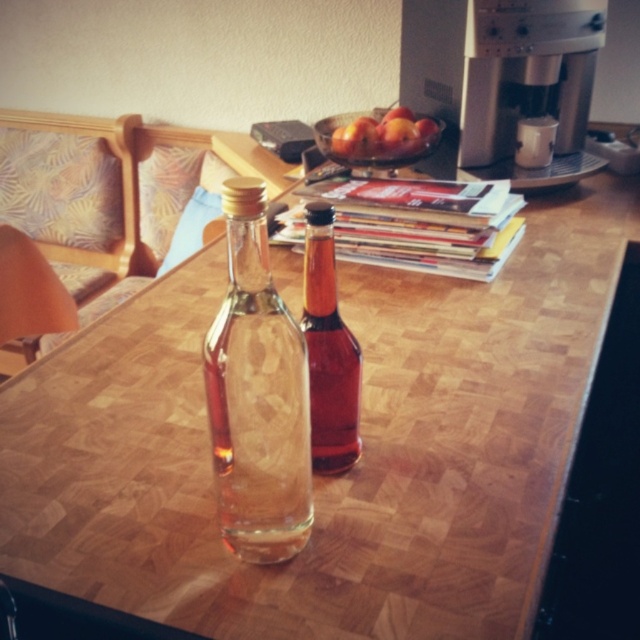
Question: Considering the relative positions of clear glass bottle at center and silver metallic coffee machine at upper right in the image provided, where is clear glass bottle at center located with respect to silver metallic coffee machine at upper right?

Choices:
 (A) above
 (B) below

Answer: (B)

Question: Which of the following is the closest to the observer?

Choices:
 (A) translucent glass bottle at center
 (B) smooth red apples at center
 (C) clear glass bottle at center
 (D) silver metallic coffee machine at upper right

Answer: (C)

Question: Can you confirm if silver metallic coffee machine at upper right is positioned to the right of smooth red apples at center?

Choices:
 (A) yes
 (B) no

Answer: (A)

Question: Estimate the real-world distances between objects in this image. Which object is closer to the clear glass bottle at center?

Choices:
 (A) silver metallic coffee machine at upper right
 (B) translucent glass bottle at center
 (C) smooth red apples at center

Answer: (B)

Question: Estimate the real-world distances between objects in this image. Which object is closer to the smooth red apples at center?

Choices:
 (A) silver metallic coffee machine at upper right
 (B) clear glass bottle at center

Answer: (A)

Question: Is clear glass bottle at center to the right of silver metallic coffee machine at upper right from the viewer's perspective?

Choices:
 (A) yes
 (B) no

Answer: (B)